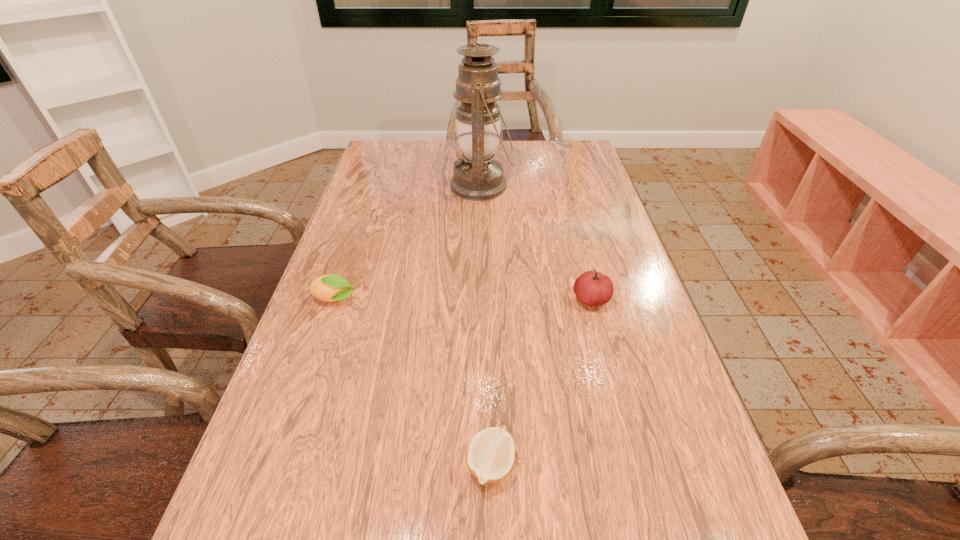
This screenshot has height=540, width=960. Find the location of `vacant space located with leaves positioned above the second shortest object`. vacant space located with leaves positioned above the second shortest object is located at coordinates (385, 300).

This screenshot has width=960, height=540. Identify the location of vacant space situated on the right of the nearer lemon. tap(706, 465).

Where is `object that is positioned at the far edge`? object that is positioned at the far edge is located at coordinates (478, 177).

Locate an element on the screen. The width and height of the screenshot is (960, 540). object at the left edge is located at coordinates (331, 287).

Locate an element on the screen. object present at the right edge is located at coordinates (592, 288).

Locate an element on the screen. The width and height of the screenshot is (960, 540). free region at the far edge of the desktop is located at coordinates (443, 140).

I want to click on vacant space at the left edge of the desktop, so click(329, 471).

The width and height of the screenshot is (960, 540). Find the location of `vacant space at the right edge`. vacant space at the right edge is located at coordinates (681, 431).

This screenshot has height=540, width=960. I want to click on vacant area between the farthest object and the nearer lemon, so click(486, 325).

Where is `vacant region between the taller lemon and the shortest object`? vacant region between the taller lemon and the shortest object is located at coordinates (413, 382).